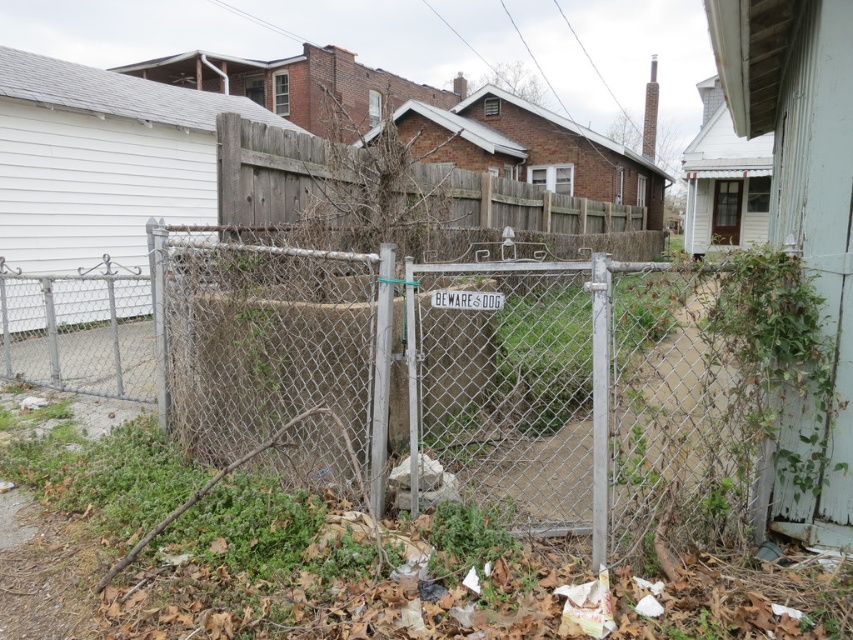
Question: Which of the following is the closest to the observer?

Choices:
 (A) (451, 296)
 (B) (573, 307)
 (C) (726, 230)

Answer: (A)

Question: Does rusty chain-link fence at center have a larger size compared to white wood door at upper right?

Choices:
 (A) no
 (B) yes

Answer: (A)

Question: Estimate the real-world distances between objects in this image. Which object is farther from the rusty chain-link fence at center?

Choices:
 (A) white plastic sign at center
 (B) white wood door at upper right

Answer: (B)

Question: Does rusty chain-link fence at center have a larger size compared to white wood door at upper right?

Choices:
 (A) no
 (B) yes

Answer: (A)

Question: Which object is the farthest from the rusty chain-link fence at center?

Choices:
 (A) white plastic sign at center
 (B) white wood door at upper right

Answer: (B)

Question: Is the position of white wood door at upper right more distant than that of white plastic sign at center?

Choices:
 (A) yes
 (B) no

Answer: (A)